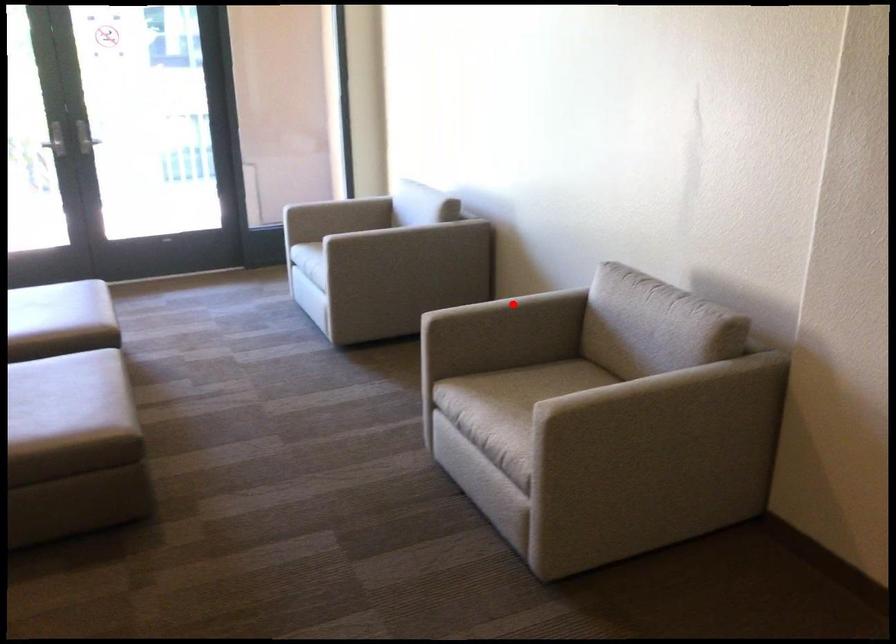
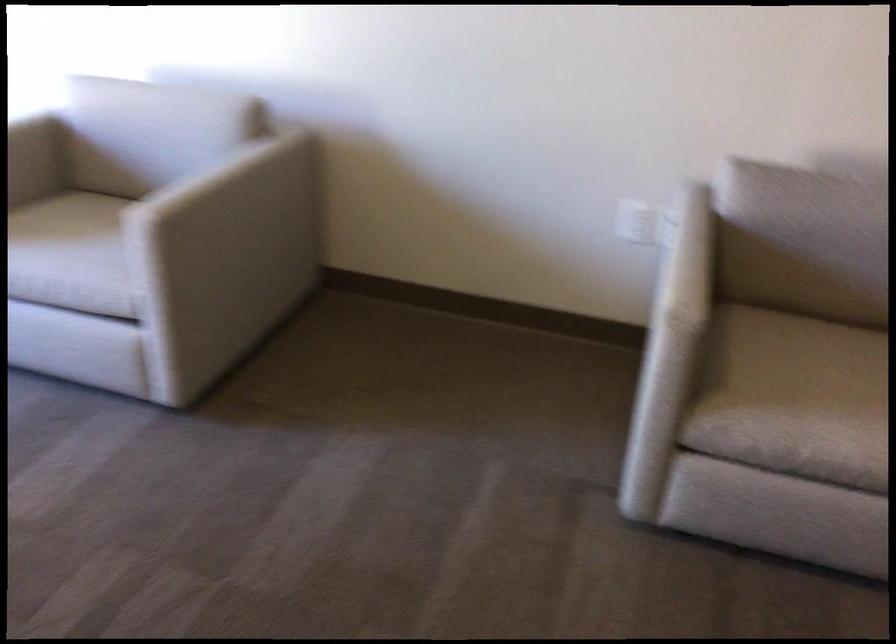
Find the pixel in the second image that matches the highlighted location in the first image.

(702, 252)